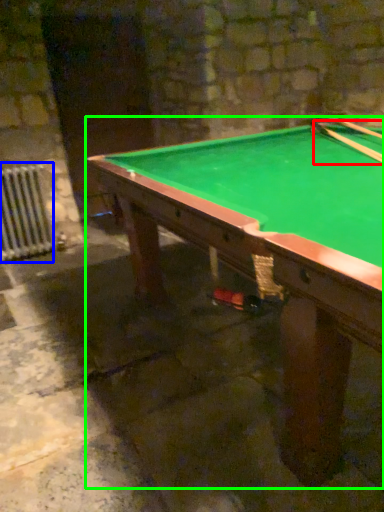
Question: Based on their relative distances, which object is farther from cue (highlighted by a red box)? Choose from radiator (highlighted by a blue box) and billiard table (highlighted by a green box).

Choices:
 (A) radiator
 (B) billiard table

Answer: (A)